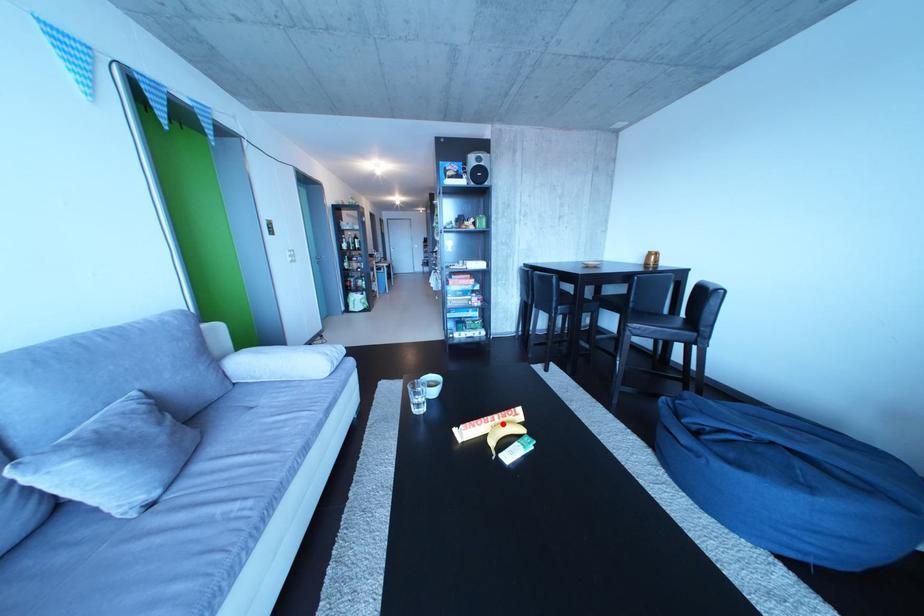
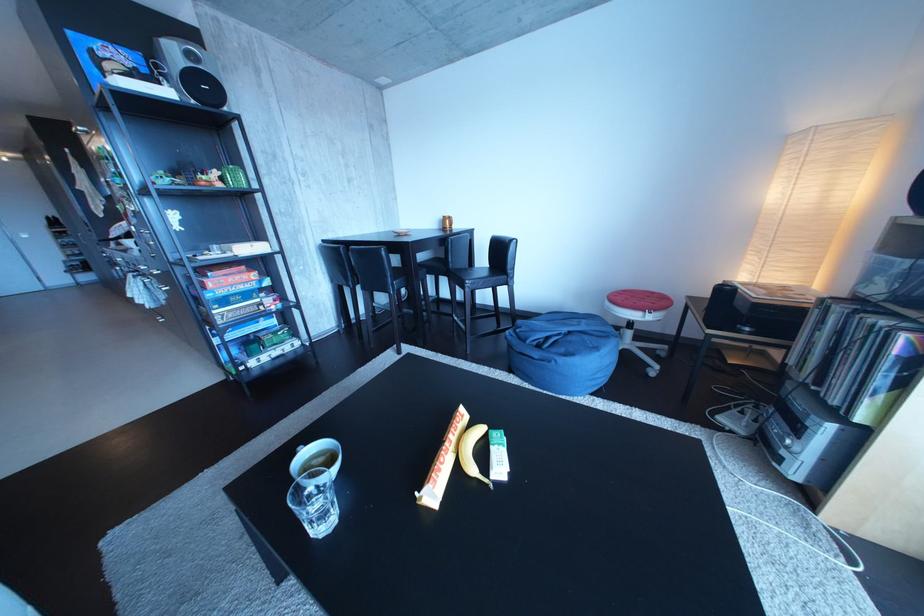
The point at the highlighted location is marked in the first image. Where is the corresponding point in the second image?

(459, 450)